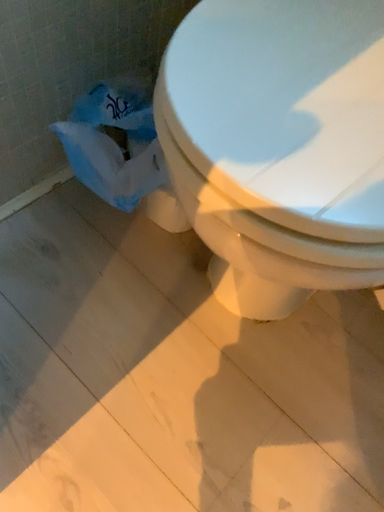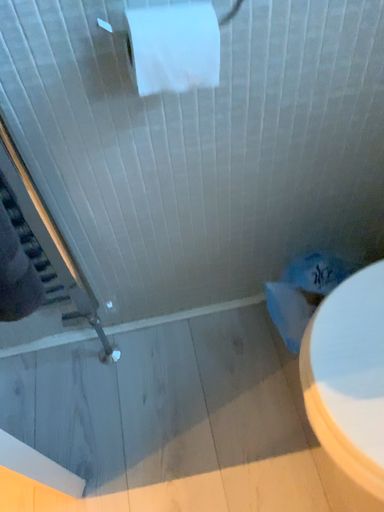
Question: Which way did the camera rotate in the video?

Choices:
 (A) rotated downward
 (B) rotated upward

Answer: (B)